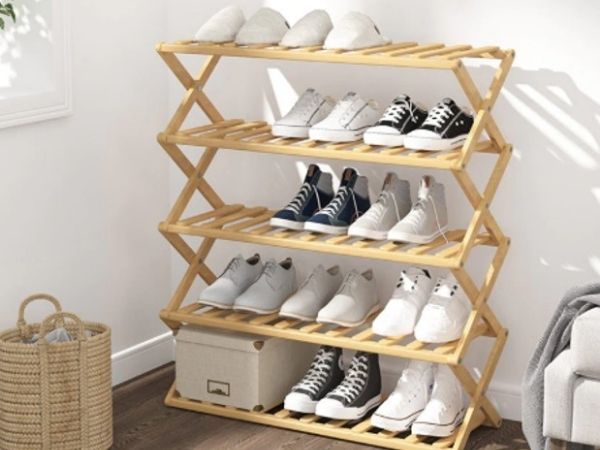
Locate an element on the screen. shoes on bottom shelf is located at coordinates (304, 386), (337, 401), (391, 407), (438, 416).